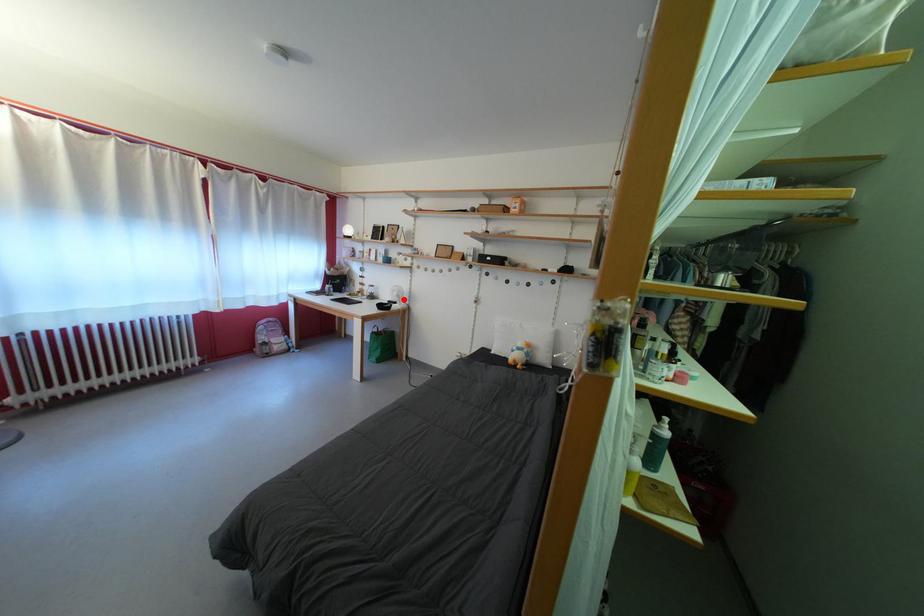
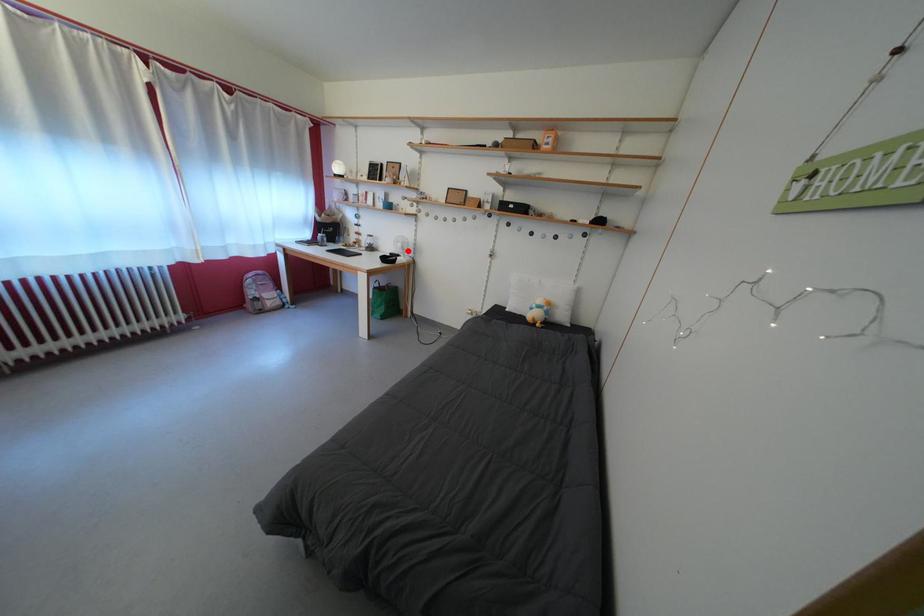
I am providing you with two images of the same scene from different viewpoints. A red point is marked on the first image and another point is marked on the second image. Is the marked point in image1 the same physical position as the marked point in image2?

Yes